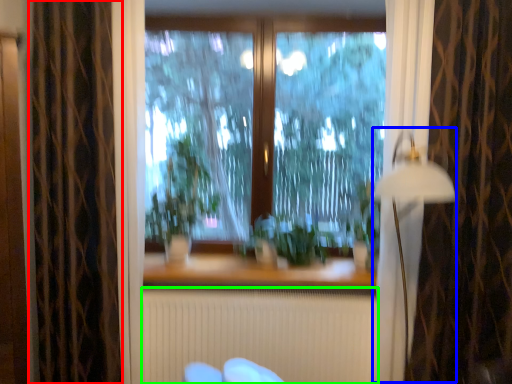
Question: Estimate the real-world distances between objects in this image. Which object is closer to curtain (highlighted by a red box), lamp (highlighted by a blue box) or radiator (highlighted by a green box)?

Choices:
 (A) lamp
 (B) radiator

Answer: (B)